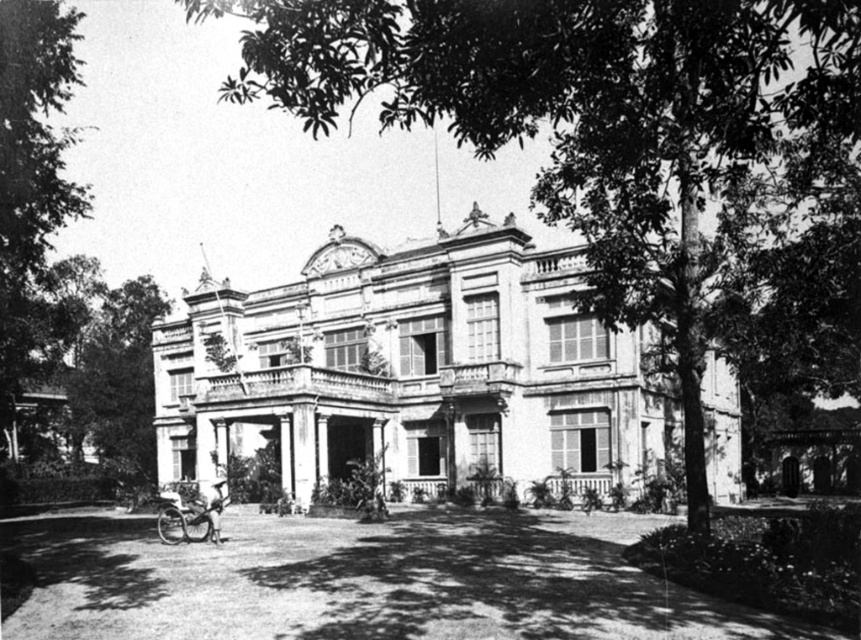
What is located at the coordinates point (x=413, y=369) in the image?

The white stone mansion at center is located at point (x=413, y=369).

You are standing at the point closest to the viewer. Which point is farther away from you between point (x=350, y=273) and point (x=209, y=520)?

Point (x=350, y=273) is farther away from you than point (x=209, y=520) because it is positioned behind the latter.